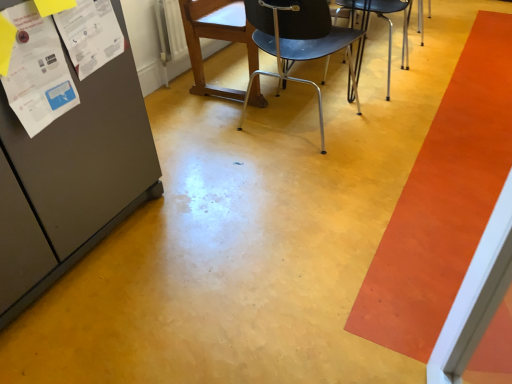
Question: Which direction should I rotate to face wooden chair at center, marked as the third chair in a right-to-left arrangement, — up or down?

Choices:
 (A) up
 (B) down

Answer: (A)

Question: Does white paper poster at left, the 2th poster viewed from the right, lie in front of orange smooth carpet at right?

Choices:
 (A) yes
 (B) no

Answer: (A)

Question: Does white paper poster at left, the 2th poster viewed from the right, appear on the left side of orange smooth carpet at right?

Choices:
 (A) yes
 (B) no

Answer: (A)

Question: From the image's perspective, is white paper poster at left, the 2th poster viewed from the right, over orange smooth carpet at right?

Choices:
 (A) no
 (B) yes

Answer: (A)

Question: Does white paper poster at left, the 2th poster viewed from the right, have a greater height compared to orange smooth carpet at right?

Choices:
 (A) yes
 (B) no

Answer: (A)

Question: From a real-world perspective, is white paper poster at left, which is the 1th poster from left to right, over orange smooth carpet at right?

Choices:
 (A) yes
 (B) no

Answer: (A)

Question: Is white paper poster at left, the 2th poster viewed from the right, located outside orange smooth carpet at right?

Choices:
 (A) no
 (B) yes

Answer: (B)

Question: Does metallic silver chair at center, acting as the 2th chair starting from the right, appear on the left side of white paper at upper left, positioned as the first poster in right-to-left order?

Choices:
 (A) no
 (B) yes

Answer: (A)

Question: Does metallic silver chair at center, acting as the 2th chair starting from the right, have a greater width compared to white paper at upper left, positioned as the first poster in right-to-left order?

Choices:
 (A) no
 (B) yes

Answer: (B)

Question: Can you confirm if metallic silver chair at center, the 2th chair when ordered from left to right, is smaller than white paper at upper left, which is the 2th poster from left to right?

Choices:
 (A) no
 (B) yes

Answer: (A)

Question: From the image's perspective, is metallic silver chair at center, acting as the 2th chair starting from the right, on white paper at upper left, which is the 2th poster from left to right?

Choices:
 (A) yes
 (B) no

Answer: (A)

Question: Does metallic silver chair at center, acting as the 2th chair starting from the right, have a lesser width compared to white paper at upper left, positioned as the first poster in right-to-left order?

Choices:
 (A) no
 (B) yes

Answer: (A)

Question: Is the position of metallic silver chair at center, acting as the 2th chair starting from the right, more distant than that of white paper at upper left, which is the 2th poster from left to right?

Choices:
 (A) no
 (B) yes

Answer: (B)

Question: From a real-world perspective, is metallic silver chair at center, acting as the 2th chair starting from the right, physically above metallic black chair at center, positioned as the third chair in left-to-right order?

Choices:
 (A) no
 (B) yes

Answer: (B)